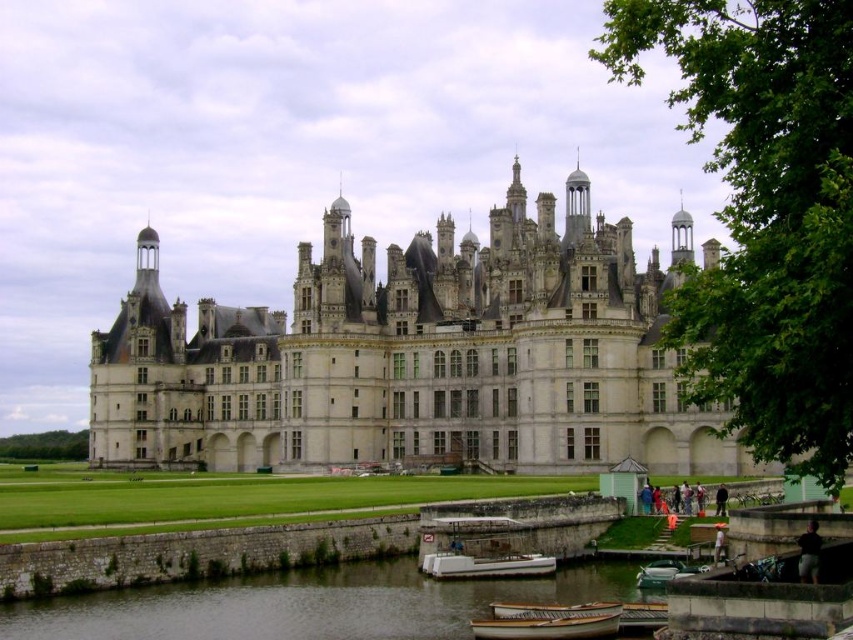
Is the position of green stone river at lower center less distant than that of white plastic boat at lower center?

That is True.

Who is more forward, (389, 563) or (519, 563)?

Positioned in front is point (519, 563).

The height and width of the screenshot is (640, 853). Find the location of `green stone river at lower center`. green stone river at lower center is located at coordinates (310, 604).

Is green stone river at lower center further to the viewer compared to green polished wood boat at lower center?

That is False.

Which is above, green stone river at lower center or green polished wood boat at lower center?

green polished wood boat at lower center

Image resolution: width=853 pixels, height=640 pixels. What do you see at coordinates (310, 604) in the screenshot? I see `green stone river at lower center` at bounding box center [310, 604].

You are a GUI agent. You are given a task and a screenshot of the screen. Output one action in this format:
    pyautogui.click(x=<x>, y=<y>)
    Task: Click on the green stone river at lower center
    The height and width of the screenshot is (640, 853).
    Given the screenshot: What is the action you would take?
    pyautogui.click(x=310, y=604)

Between white stone castle at center and wooden boat at lower center, which one is positioned lower?

wooden boat at lower center

Does white stone castle at center appear on the right side of wooden boat at lower center?

In fact, white stone castle at center is to the left of wooden boat at lower center.

You are a GUI agent. You are given a task and a screenshot of the screen. Output one action in this format:
    pyautogui.click(x=<x>, y=<y>)
    Task: Click on the white stone castle at center
    The height and width of the screenshot is (640, 853).
    Given the screenshot: What is the action you would take?
    pyautogui.click(x=416, y=356)